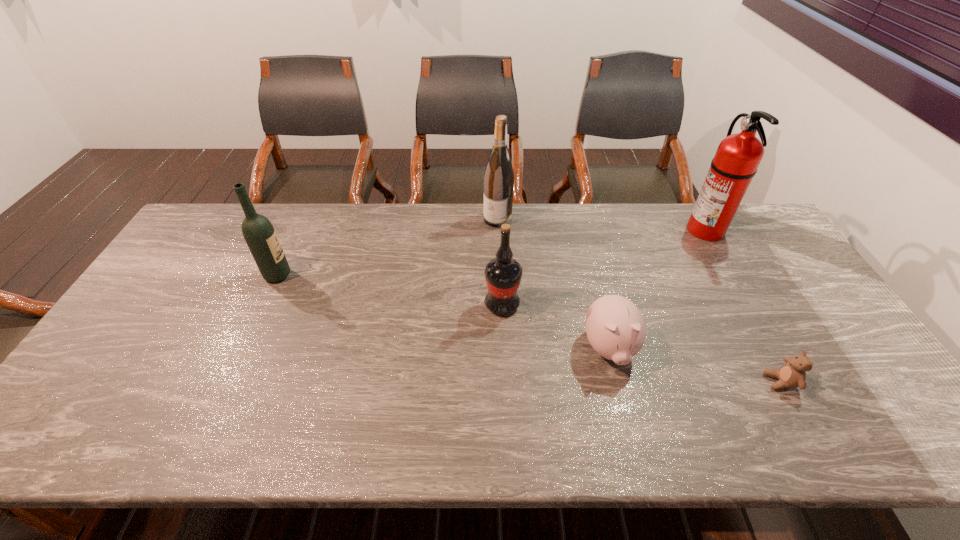
This screenshot has height=540, width=960. In order to click on free point between the piggy bank and the fire extinguisher in this screenshot , I will do `click(657, 289)`.

Locate an element on the screen. The image size is (960, 540). free spot between the fourth object from left to right and the nearest wine bottle is located at coordinates (556, 327).

You are a GUI agent. You are given a task and a screenshot of the screen. Output one action in this format:
    pyautogui.click(x=<x>, y=<y>)
    Task: Click on the unoccupied area between the farthest wine bottle and the leftmost wine bottle
    
    Given the screenshot: What is the action you would take?
    pyautogui.click(x=388, y=247)

You are a GUI agent. You are given a task and a screenshot of the screen. Output one action in this format:
    pyautogui.click(x=<x>, y=<y>)
    Task: Click on the free point between the fourth object from left to right and the shortest object
    The image size is (960, 540).
    Given the screenshot: What is the action you would take?
    pyautogui.click(x=695, y=365)

You are a GUI agent. You are given a task and a screenshot of the screen. Output one action in this format:
    pyautogui.click(x=<x>, y=<y>)
    Task: Click on the vacant area that lies between the leftmost object and the piggy bank
    Image resolution: width=960 pixels, height=540 pixels.
    Given the screenshot: What is the action you would take?
    pyautogui.click(x=444, y=312)

Image resolution: width=960 pixels, height=540 pixels. Identify the location of empty space between the fire extinguisher and the second nearest wine bottle. (492, 252).

Locate an element on the screen. object that is the fourth closest to the shortest object is located at coordinates (499, 177).

Image resolution: width=960 pixels, height=540 pixels. I want to click on object that stands as the fifth closest to the leftmost object, so click(792, 374).

You are a GUI agent. You are given a task and a screenshot of the screen. Output one action in this format:
    pyautogui.click(x=<x>, y=<y>)
    Task: Click on the wine bottle that is the third closest to the teddy bear
    The image size is (960, 540).
    Given the screenshot: What is the action you would take?
    pyautogui.click(x=259, y=234)

Identify which wine bottle is the third closest to the teddy bear. Please provide its 2D coordinates. Your answer should be formatted as a tuple, i.e. [(x, y)], where the tuple contains the x and y coordinates of a point satisfying the conditions above.

[(259, 234)]